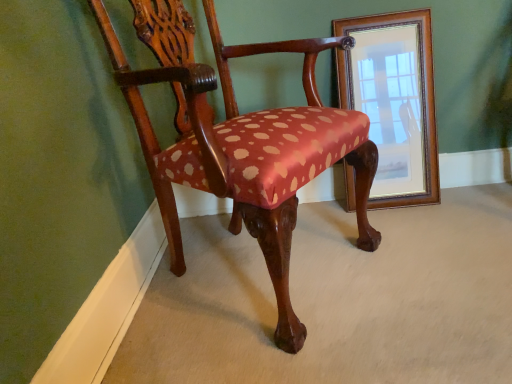
Question: In terms of height, does wooden framed mirror at upper right look taller or shorter compared to polished wood chair at center?

Choices:
 (A) short
 (B) tall

Answer: (A)

Question: Choose the correct answer: Is wooden framed mirror at upper right inside polished wood chair at center or outside it?

Choices:
 (A) inside
 (B) outside

Answer: (B)

Question: From a real-world perspective, is wooden framed mirror at upper right above or below polished wood chair at center?

Choices:
 (A) above
 (B) below

Answer: (B)

Question: From their relative heights in the image, would you say polished wood chair at center is taller or shorter than wooden framed mirror at upper right?

Choices:
 (A) tall
 (B) short

Answer: (A)

Question: From a real-world perspective, is polished wood chair at center positioned above or below wooden framed mirror at upper right?

Choices:
 (A) above
 (B) below

Answer: (A)

Question: Considering the positions of polished wood chair at center and wooden framed mirror at upper right in the image, is polished wood chair at center wider or thinner than wooden framed mirror at upper right?

Choices:
 (A) thin
 (B) wide

Answer: (B)

Question: Considering the positions of point (338, 112) and point (388, 129), is point (338, 112) closer or farther from the camera than point (388, 129)?

Choices:
 (A) farther
 (B) closer

Answer: (B)